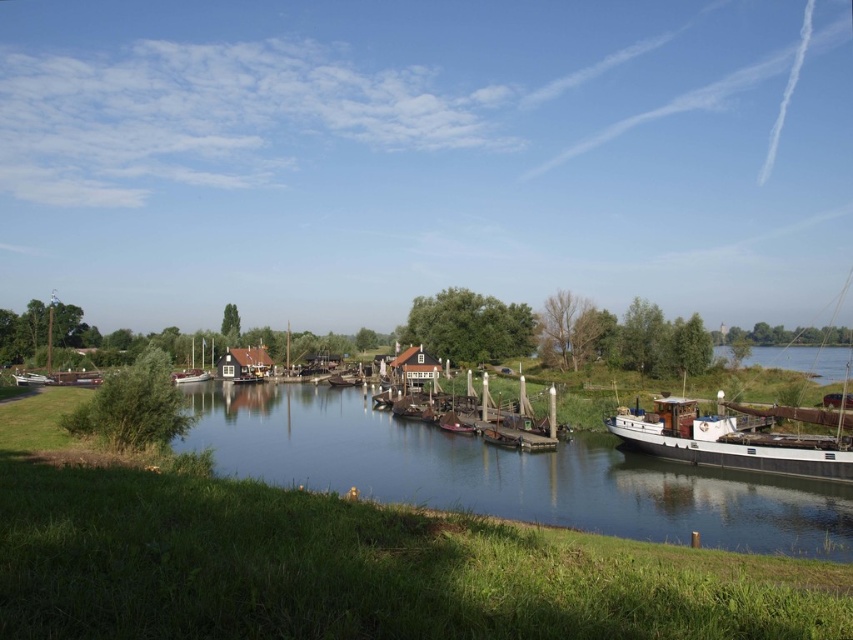
Looking at this image, you are standing on the grassy slope on the left bank of the river and want to board the wooden boat at center and the wooden sailboat at center. Which one would you need to walk towards first if you want to reach the one closer to the water?

The wooden boat at center is located below the wooden sailboat at center, so it is closer to the water. Therefore, you should walk towards the wooden boat at center first.

You are standing at the grassy area on the left bank of the river and want to take a photo of the boats docked on the right side. You notice two points marked in the scene. Which point, point (381, 438) or point (202, 348), is closer to you when you are facing the river?

Point (381, 438) is closer to the camera than point (202, 348), so it is closer to you when facing the river.